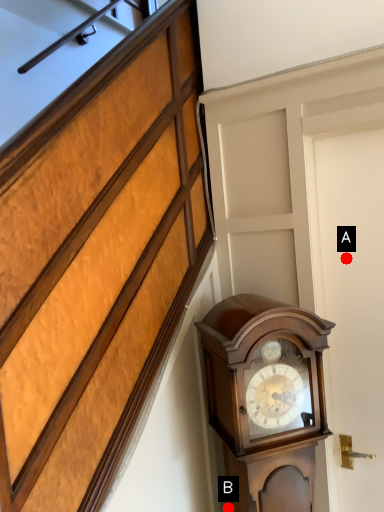
Question: Two points are circled on the image, labeled by A and B beside each circle. Which point is farther from the camera taking this photo?

Choices:
 (A) A is further
 (B) B is further

Answer: (A)